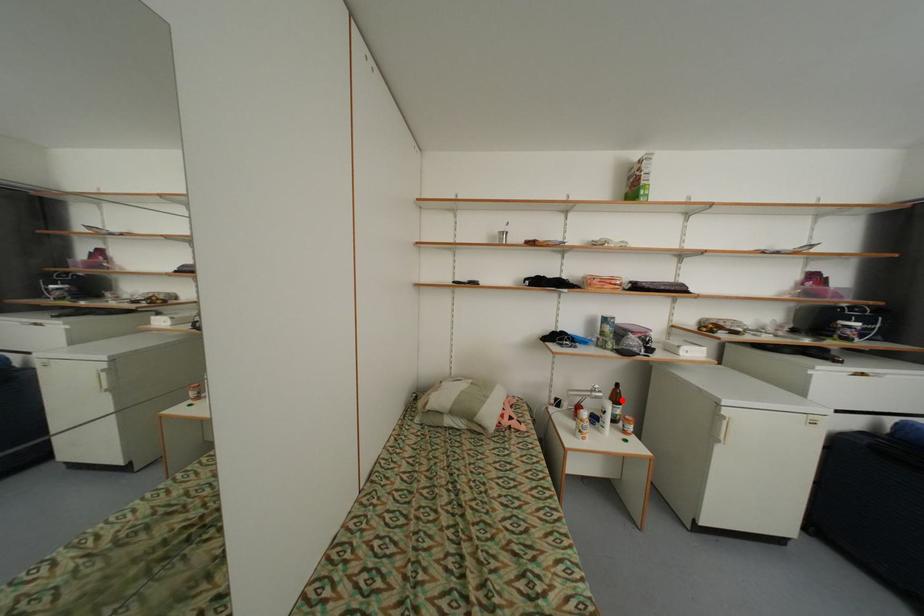
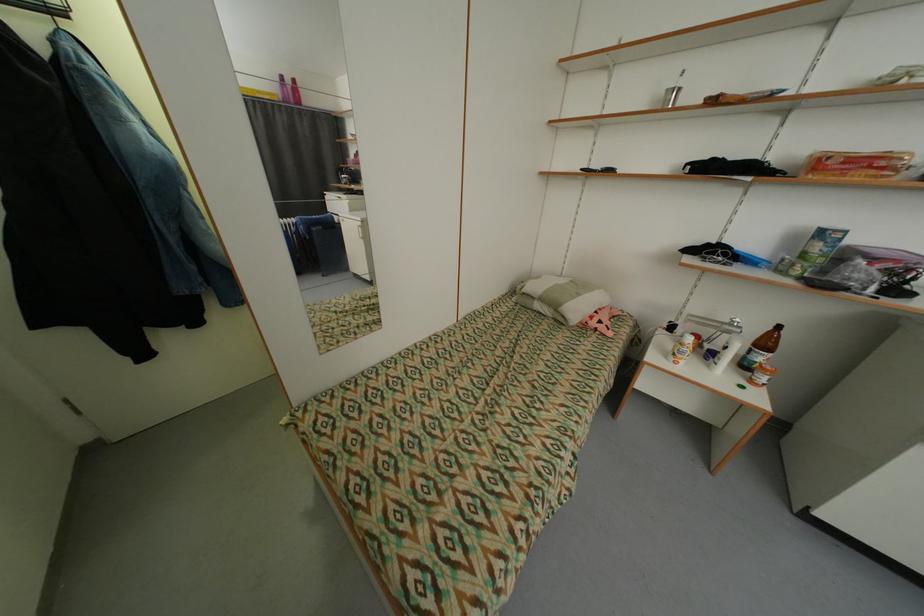
Find the pixel in the second image that matches the highlighted location in the first image.

(772, 345)